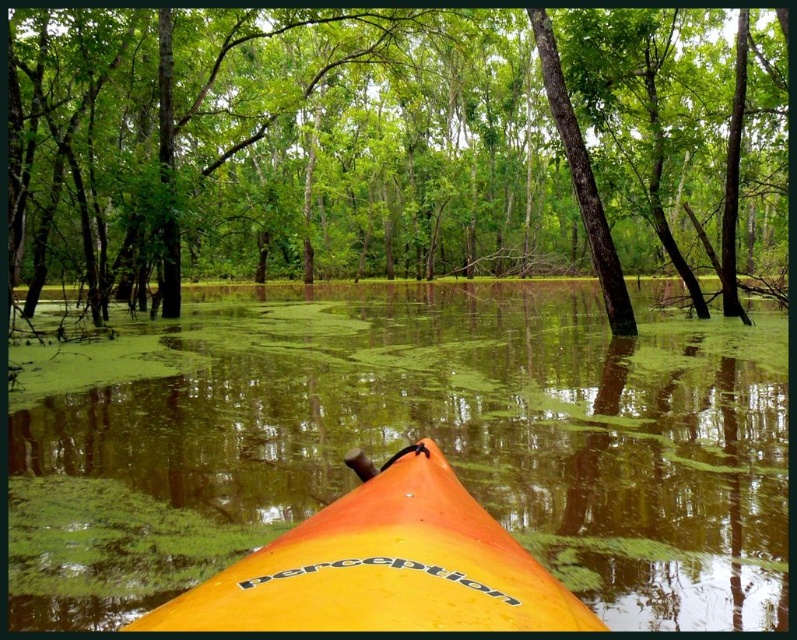
Find the location of a particular element. The height and width of the screenshot is (640, 797). green leafy tree at center is located at coordinates (395, 147).

Who is more distant from viewer, (344, 209) or (273, 470)?

Positioned behind is point (344, 209).

I want to click on green leafy tree at center, so click(x=395, y=147).

Where is `green leafy tree at center`? green leafy tree at center is located at coordinates (395, 147).

Can you confirm if green leafy tree at center is positioned to the left of orange matte kayak at center?

In fact, green leafy tree at center is to the right of orange matte kayak at center.

Is green leafy tree at center bigger than orange matte kayak at center?

Yes, green leafy tree at center is bigger than orange matte kayak at center.

What do you see at coordinates (395, 147) in the screenshot? This screenshot has height=640, width=797. I see `green leafy tree at center` at bounding box center [395, 147].

Where is `green leafy tree at center`? green leafy tree at center is located at coordinates (395, 147).

Where is `orange matte kayak at center`? The width and height of the screenshot is (797, 640). orange matte kayak at center is located at coordinates (383, 564).

Is orange matte kayak at center taller than green rough bark tree at center?

In fact, orange matte kayak at center may be shorter than green rough bark tree at center.

Is point (336, 592) behind point (617, 317)?

No.

You are a GUI agent. You are given a task and a screenshot of the screen. Output one action in this format:
    pyautogui.click(x=<x>, y=<y>)
    Task: Click on the orange matte kayak at center
    
    Given the screenshot: What is the action you would take?
    pyautogui.click(x=383, y=564)